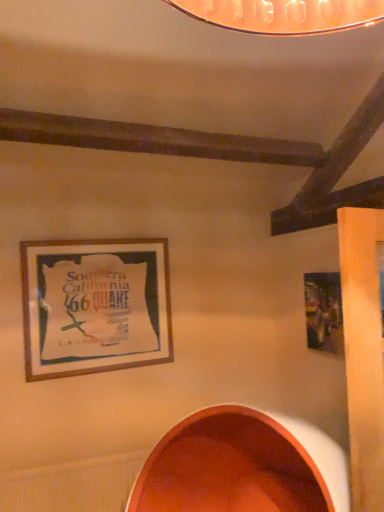
Question: Does metallic silver picture frame at right, positioned as the 1th picture frame in right-to-left order, touch matte orange bowl at lower center?

Choices:
 (A) yes
 (B) no

Answer: (B)

Question: Is metallic silver picture frame at right, positioned as the 1th picture frame in right-to-left order, positioned far away from matte orange bowl at lower center?

Choices:
 (A) yes
 (B) no

Answer: (B)

Question: Is metallic silver picture frame at right, positioned as the 1th picture frame in right-to-left order, positioned beyond the bounds of matte orange bowl at lower center?

Choices:
 (A) yes
 (B) no

Answer: (A)

Question: Can you confirm if metallic silver picture frame at right, acting as the second picture frame starting from the left, is positioned to the left of matte orange bowl at lower center?

Choices:
 (A) no
 (B) yes

Answer: (A)

Question: Is metallic silver picture frame at right, acting as the second picture frame starting from the left, wider than matte orange bowl at lower center?

Choices:
 (A) yes
 (B) no

Answer: (B)

Question: From the image's perspective, relative to metallic silver picture frame at right, positioned as the 1th picture frame in right-to-left order, is wooden frame at upper left, placed as the second picture frame when sorted from right to left, above or below?

Choices:
 (A) below
 (B) above

Answer: (B)

Question: From a real-world perspective, is wooden frame at upper left, placed as the second picture frame when sorted from right to left, positioned above or below metallic silver picture frame at right, positioned as the 1th picture frame in right-to-left order?

Choices:
 (A) above
 (B) below

Answer: (A)

Question: Does point (102, 290) appear closer or farther from the camera than point (334, 312)?

Choices:
 (A) farther
 (B) closer

Answer: (A)

Question: Is wooden frame at upper left, the first picture frame positioned from the left, wider or thinner than metallic silver picture frame at right, acting as the second picture frame starting from the left?

Choices:
 (A) thin
 (B) wide

Answer: (B)

Question: Considering the positions of wooden frame at upper left, placed as the second picture frame when sorted from right to left, and matte orange bowl at lower center in the image, is wooden frame at upper left, placed as the second picture frame when sorted from right to left, taller or shorter than matte orange bowl at lower center?

Choices:
 (A) tall
 (B) short

Answer: (B)

Question: Looking at the image, does wooden frame at upper left, the first picture frame positioned from the left, seem bigger or smaller compared to matte orange bowl at lower center?

Choices:
 (A) big
 (B) small

Answer: (B)

Question: Is wooden frame at upper left, the first picture frame positioned from the left, inside the boundaries of matte orange bowl at lower center, or outside?

Choices:
 (A) inside
 (B) outside

Answer: (B)

Question: From a real-world perspective, is wooden frame at upper left, placed as the second picture frame when sorted from right to left, positioned above or below matte orange bowl at lower center?

Choices:
 (A) above
 (B) below

Answer: (A)

Question: From their relative heights in the image, would you say metallic silver picture frame at right, acting as the second picture frame starting from the left, is taller or shorter than wooden frame at upper left, placed as the second picture frame when sorted from right to left?

Choices:
 (A) short
 (B) tall

Answer: (A)

Question: From the image's perspective, relative to wooden frame at upper left, the first picture frame positioned from the left, is metallic silver picture frame at right, positioned as the 1th picture frame in right-to-left order, above or below?

Choices:
 (A) above
 (B) below

Answer: (B)